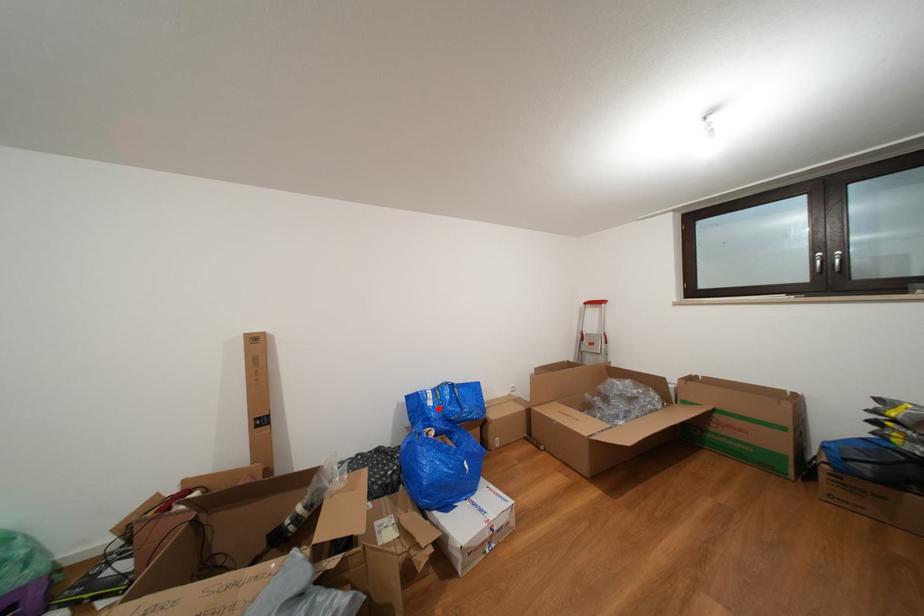
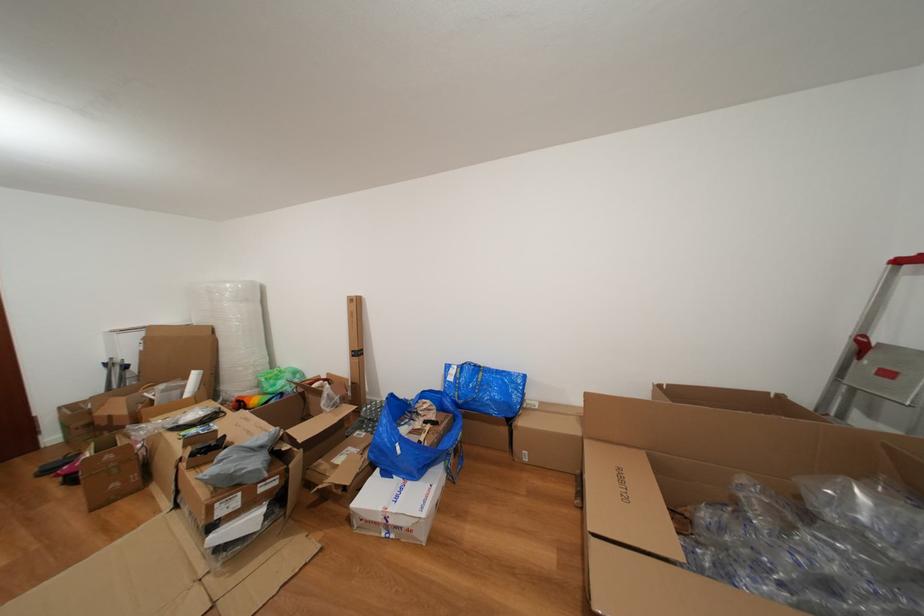
Find the pixel in the second image that matches the highlighted location in the first image.

(458, 384)